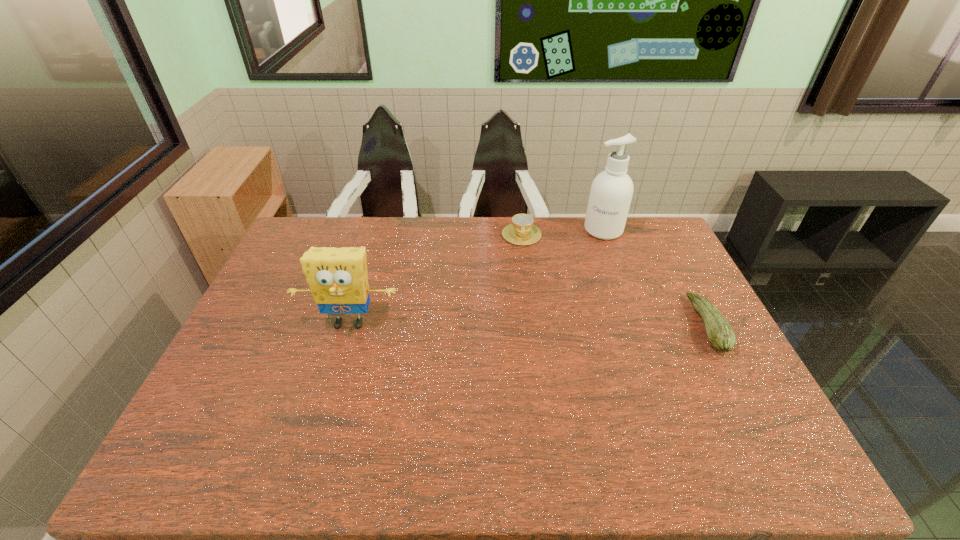
At what (x,y) coordinates should I click in order to perform the action: click on vacant space positioned with the handle on the side of the cup. Please return your answer as a coordinate pair (x, y). This screenshot has height=540, width=960. Looking at the image, I should click on point(523,282).

In order to click on vacant space located with the handle on the side of the cup in this screenshot , I will do (x=523, y=274).

In order to click on vacant area located 0.230m with the handle on the side of the cup in this screenshot , I will do `click(523, 291)`.

You are a GUI agent. You are given a task and a screenshot of the screen. Output one action in this format:
    pyautogui.click(x=<x>, y=<y>)
    Task: Click on the free space located 0.180m on the front label of the cleansing agent
    The width and height of the screenshot is (960, 540).
    Given the screenshot: What is the action you would take?
    pyautogui.click(x=588, y=271)

At what (x,y) coordinates should I click in order to perform the action: click on vacant area situated 0.220m on the front label of the cleansing agent. Please return your answer as a coordinate pair (x, y). Image resolution: width=960 pixels, height=540 pixels. Looking at the image, I should click on (587, 278).

I want to click on vacant region located on the front label of the cleansing agent, so click(591, 264).

The height and width of the screenshot is (540, 960). Find the location of `cup that is at the far edge`. cup that is at the far edge is located at coordinates (522, 231).

Locate an element on the screen. This screenshot has height=540, width=960. cleansing agent that is positioned at the far edge is located at coordinates (611, 192).

Identify the location of object that is at the left edge. (338, 279).

Find the location of a particular element. zucchini that is at the right edge is located at coordinates 720,334.